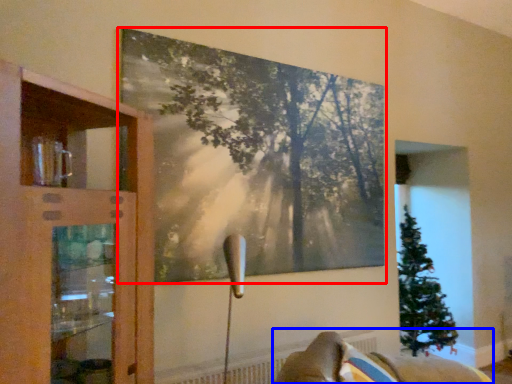
Question: Which point is closer to the camera, picture frame (highlighted by a red box) or furniture (highlighted by a blue box)?

Choices:
 (A) picture frame
 (B) furniture

Answer: (B)